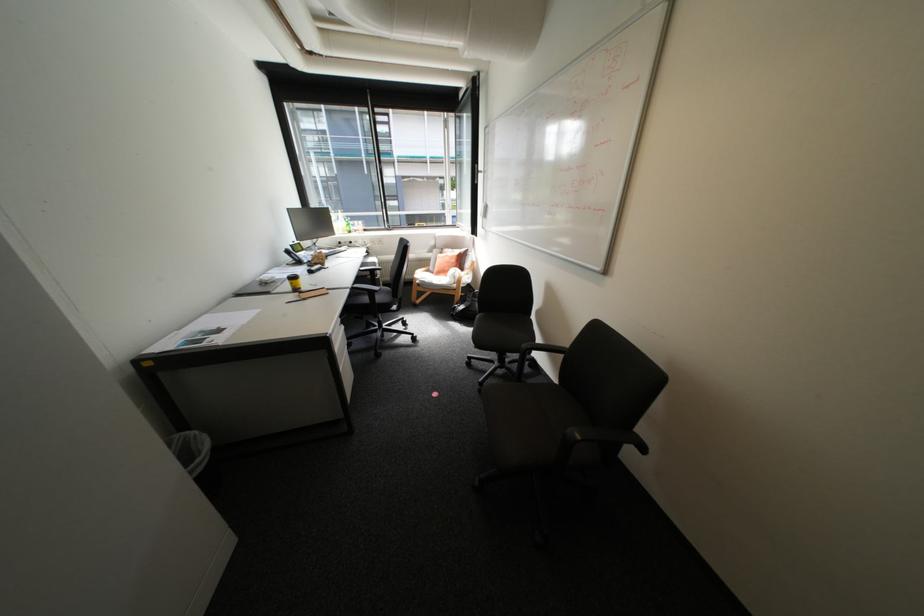
Where is `brown paper notebook`? brown paper notebook is located at coordinates (311, 293).